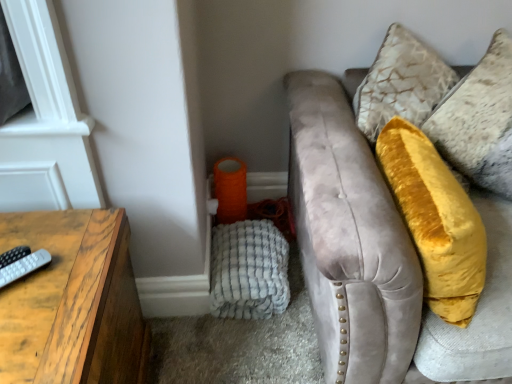
Question: Considering the relative positions of gray matte remote at left and velvet yellow pillow at upper right in the image provided, is gray matte remote at left to the right of velvet yellow pillow at upper right from the viewer's perspective?

Choices:
 (A) yes
 (B) no

Answer: (B)

Question: Is the position of gray matte remote at left more distant than that of velvet yellow pillow at upper right?

Choices:
 (A) yes
 (B) no

Answer: (B)

Question: Could you tell me if gray matte remote at left is turned towards velvet yellow pillow at upper right?

Choices:
 (A) yes
 (B) no

Answer: (B)

Question: Is gray matte remote at left positioned with its back to velvet yellow pillow at upper right?

Choices:
 (A) yes
 (B) no

Answer: (B)

Question: From a real-world perspective, is gray matte remote at left over velvet yellow pillow at upper right?

Choices:
 (A) yes
 (B) no

Answer: (B)

Question: In terms of height, does white textured blanket at lower left look taller or shorter compared to velvet yellow pillow at upper right?

Choices:
 (A) short
 (B) tall

Answer: (A)

Question: Does point (259, 299) appear closer or farther from the camera than point (461, 87)?

Choices:
 (A) farther
 (B) closer

Answer: (A)

Question: Is white textured blanket at lower left bigger or smaller than velvet yellow pillow at upper right?

Choices:
 (A) big
 (B) small

Answer: (B)

Question: From the image's perspective, is white textured blanket at lower left positioned above or below velvet yellow pillow at upper right?

Choices:
 (A) above
 (B) below

Answer: (B)

Question: Would you say white textured blanket at lower left is to the left or to the right of gray matte remote at left in the picture?

Choices:
 (A) left
 (B) right

Answer: (B)

Question: From the image's perspective, is white textured blanket at lower left located above or below gray matte remote at left?

Choices:
 (A) above
 (B) below

Answer: (B)

Question: Relative to gray matte remote at left, is white textured blanket at lower left in front or behind?

Choices:
 (A) front
 (B) behind

Answer: (B)

Question: Considering the positions of white textured blanket at lower left and gray matte remote at left in the image, is white textured blanket at lower left taller or shorter than gray matte remote at left?

Choices:
 (A) tall
 (B) short

Answer: (A)

Question: Is gray matte remote at left situated inside velvet yellow pillow at upper right or outside?

Choices:
 (A) inside
 (B) outside

Answer: (B)

Question: In the image, is gray matte remote at left positioned in front of or behind velvet yellow pillow at upper right?

Choices:
 (A) behind
 (B) front

Answer: (B)